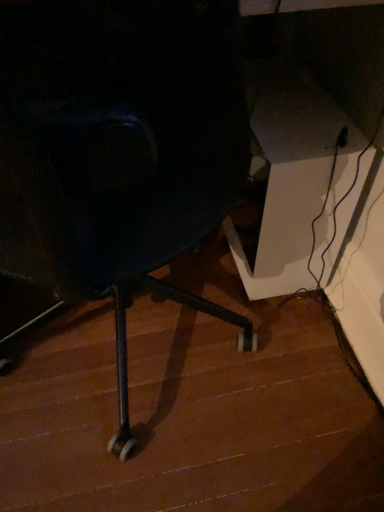
Question: Considering the positions of white glossy table at right and matte black chair at center in the image, is white glossy table at right taller or shorter than matte black chair at center?

Choices:
 (A) short
 (B) tall

Answer: (B)

Question: From the image's perspective, is white glossy table at right located above or below matte black chair at center?

Choices:
 (A) below
 (B) above

Answer: (B)

Question: Looking at their shapes, would you say white glossy table at right is wider or thinner than matte black chair at center?

Choices:
 (A) wide
 (B) thin

Answer: (B)

Question: Based on their sizes in the image, would you say matte black chair at center is bigger or smaller than white glossy table at right?

Choices:
 (A) small
 (B) big

Answer: (A)

Question: Considering the positions of point click(294, 402) and point click(307, 240), is point click(294, 402) closer or farther from the camera than point click(307, 240)?

Choices:
 (A) closer
 (B) farther

Answer: (A)

Question: Is matte black chair at center situated inside white glossy table at right or outside?

Choices:
 (A) outside
 (B) inside

Answer: (A)

Question: From a real-world perspective, is matte black chair at center physically located above or below white glossy table at right?

Choices:
 (A) above
 (B) below

Answer: (B)